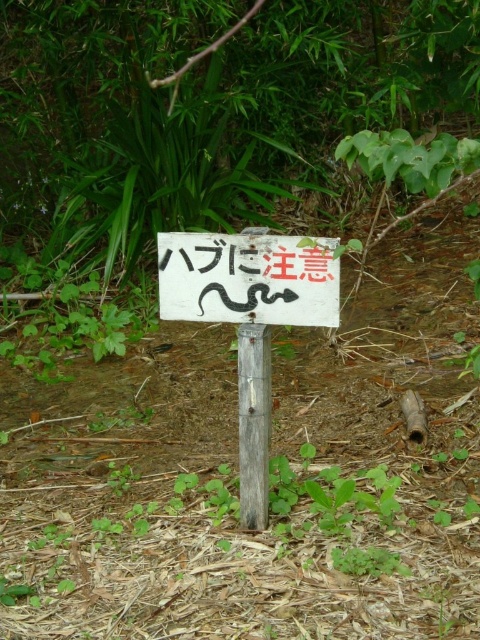
Question: Which point is closer to the camera taking this photo?

Choices:
 (A) (200, 278)
 (B) (172, 320)
 (C) (252, 342)

Answer: (C)

Question: Which object is positioned closest to the white wooden sign at center?

Choices:
 (A) weathered wood post at center
 (B) white matte sign at center

Answer: (B)

Question: Can you confirm if white wooden sign at center is smaller than white matte sign at center?

Choices:
 (A) no
 (B) yes

Answer: (A)

Question: Which of the following is the farthest from the observer?

Choices:
 (A) (256, 337)
 (B) (252, 401)

Answer: (B)

Question: In this image, where is white matte sign at center located relative to weathered wood post at center?

Choices:
 (A) left
 (B) right

Answer: (A)

Question: Does white wooden sign at center appear under weathered wood post at center?

Choices:
 (A) no
 (B) yes

Answer: (A)